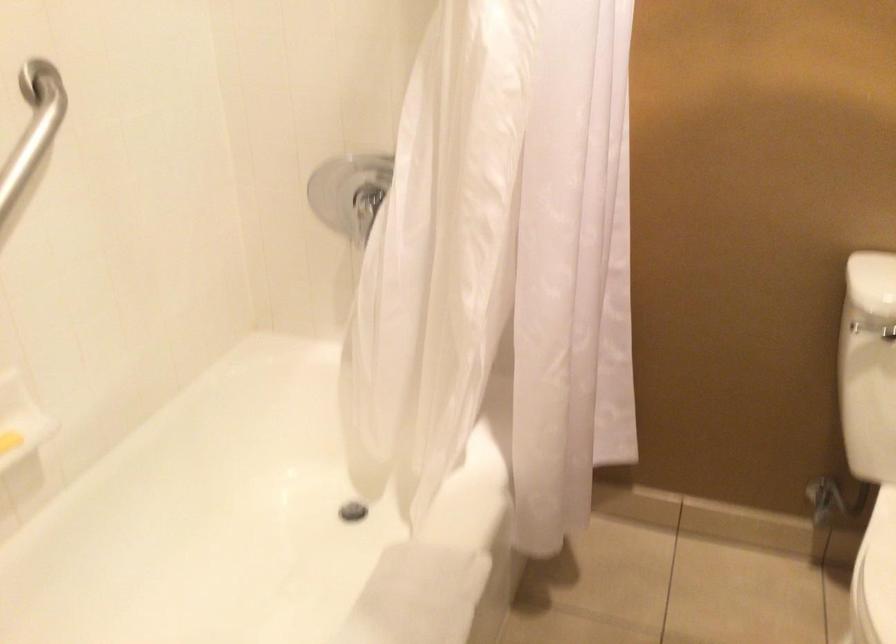
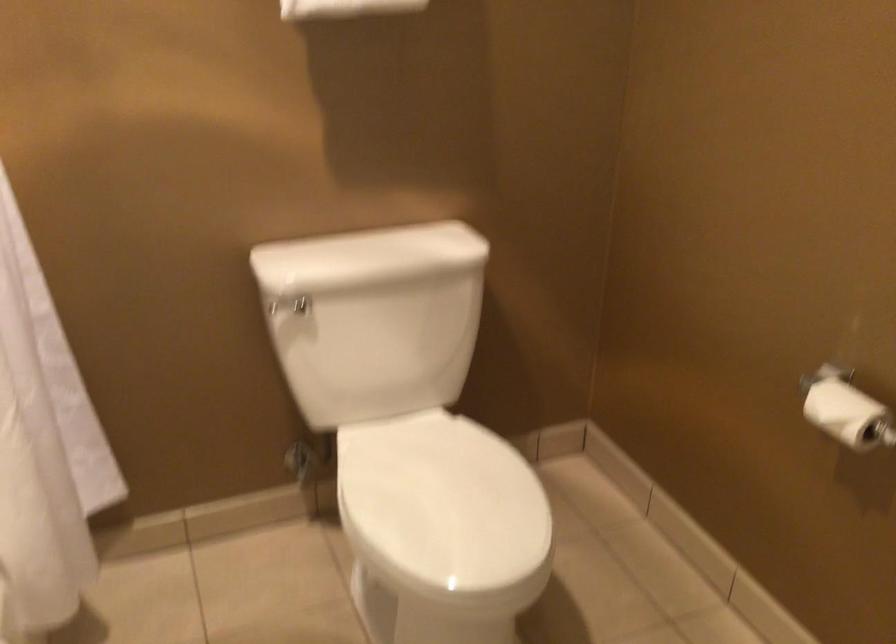
Where in the second image is the point corresponding to the point at 574,386 from the first image?

(44, 444)